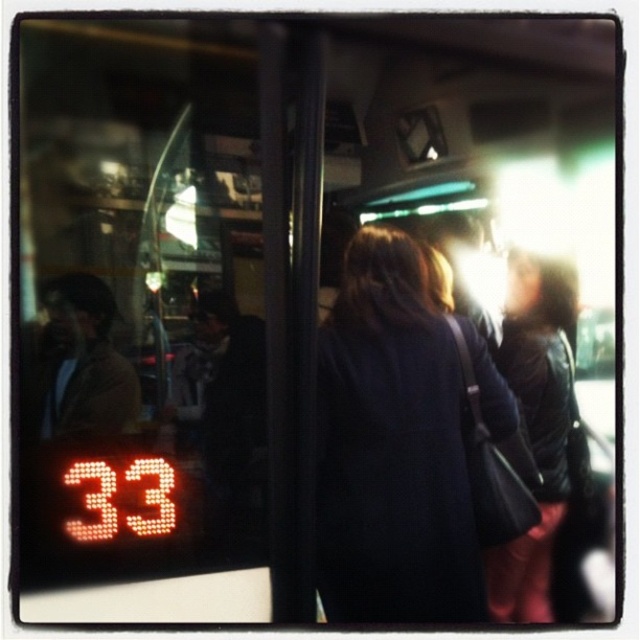
Does dark blue coat at center appear on the right side of dark brown leather jacket at right?

Incorrect, dark blue coat at center is not on the right side of dark brown leather jacket at right.

Between point (324, 326) and point (536, 449), which one is positioned in front?

Point (324, 326) is in front.

Identify the location of dark blue coat at center. The width and height of the screenshot is (640, 640). (392, 445).

Locate an element on the screen. This screenshot has width=640, height=640. dark blue coat at center is located at coordinates (392, 445).